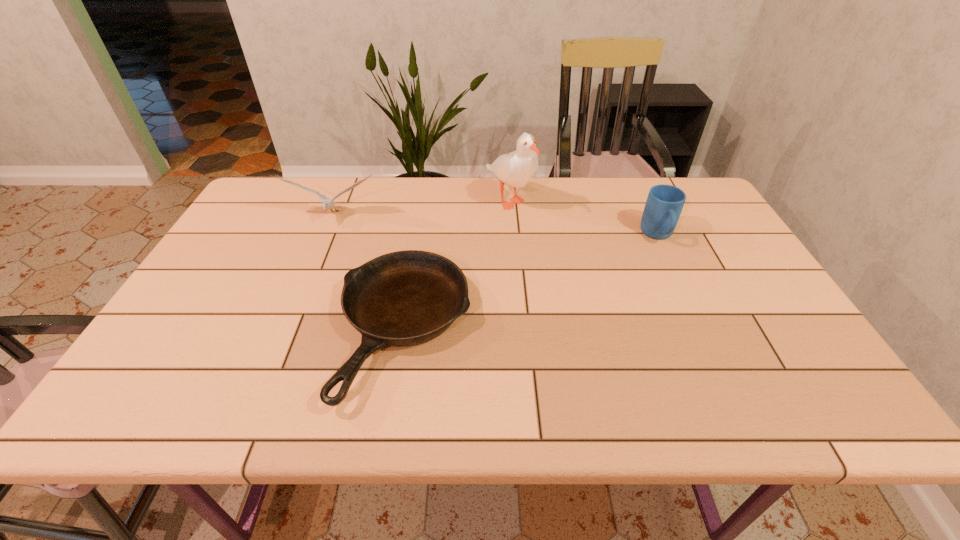
This screenshot has width=960, height=540. What are the coordinates of `free space located 0.290m on the side of the rightmost object with the handle` in the screenshot? It's located at (704, 331).

Find the location of a particular element. Image resolution: width=960 pixels, height=540 pixels. free space located 0.100m on the back of the nearest object is located at coordinates (419, 242).

I want to click on object positioned at the near edge, so click(405, 298).

Find the location of `object located in the left edge section of the desktop`. object located in the left edge section of the desktop is located at coordinates (328, 203).

Locate an element on the screen. The width and height of the screenshot is (960, 540). object that is at the far left corner is located at coordinates (328, 203).

Locate an element on the screen. free space at the far edge of the desktop is located at coordinates (478, 184).

This screenshot has width=960, height=540. Find the location of `vacant area at the near edge`. vacant area at the near edge is located at coordinates (639, 382).

Locate an element on the screen. The width and height of the screenshot is (960, 540). free spot at the left edge of the desktop is located at coordinates (207, 262).

Identify the location of free space at the right edge of the desktop. (733, 291).

Identify the location of free location at the far left corner. (299, 183).